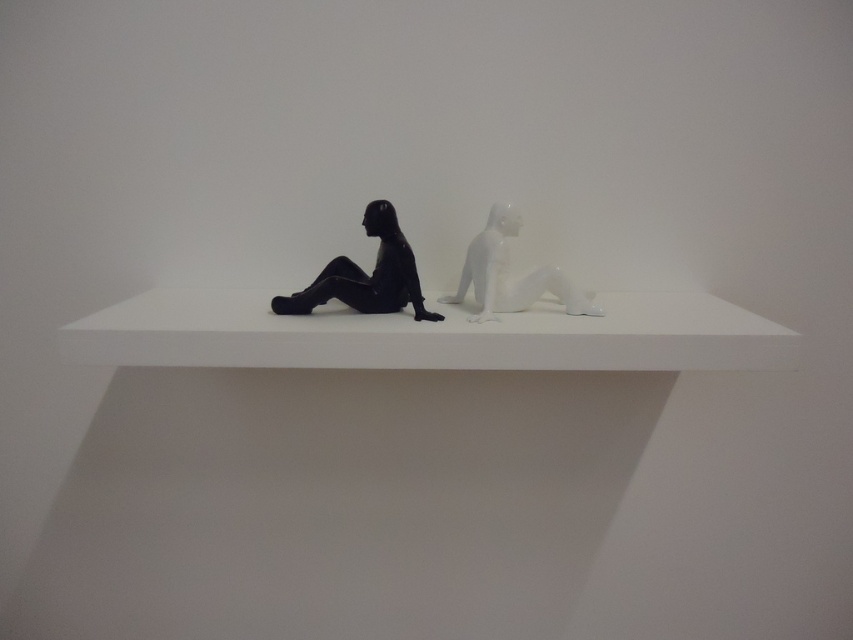
In the scene shown: Can you confirm if matte black figure at left is shorter than white glossy statue at center?

Indeed, matte black figure at left has a lesser height compared to white glossy statue at center.

Does matte black figure at left have a greater width compared to white glossy statue at center?

Yes, matte black figure at left is wider than white glossy statue at center.

Image resolution: width=853 pixels, height=640 pixels. Describe the element at coordinates (366, 275) in the screenshot. I see `matte black figure at left` at that location.

At what (x,y) coordinates should I click in order to perform the action: click on matte black figure at left. Please return your answer as a coordinate pair (x, y). This screenshot has height=640, width=853. Looking at the image, I should click on (366, 275).

Who is more forward, (759, 323) or (503, 237)?

Point (759, 323)

Does white glossy ledge at center have a smaller size compared to white glossy statue at center?

No.

What are the coordinates of `white glossy ledge at center` in the screenshot? It's located at tap(430, 336).

Where is `white glossy ledge at center`? white glossy ledge at center is located at coordinates (430, 336).

Based on the photo, which is above, white glossy ledge at center or matte black figure at left?

matte black figure at left is above.

Does white glossy ledge at center have a smaller size compared to matte black figure at left?

No.

Does point (392, 333) lie in front of point (318, 284)?

Yes.

Locate an element on the screen. This screenshot has width=853, height=640. white glossy ledge at center is located at coordinates (430, 336).